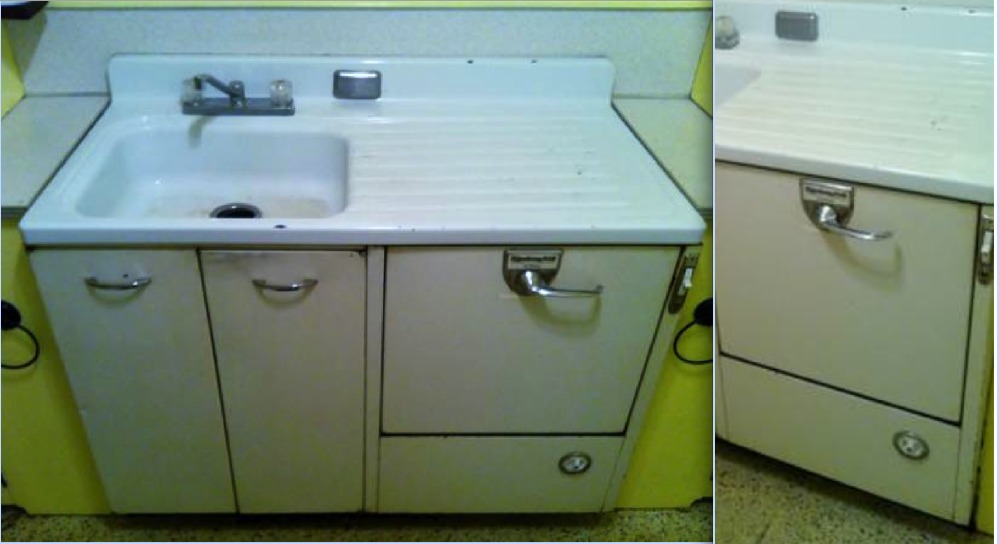
In order to click on cupboarr in this screenshot , I will do `click(111, 420)`.